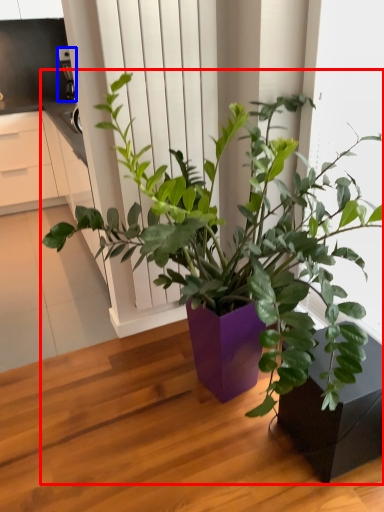
Question: Which of the following is the closest to the observer, houseplant (highlighted by a red box) or appliance (highlighted by a blue box)?

Choices:
 (A) houseplant
 (B) appliance

Answer: (A)